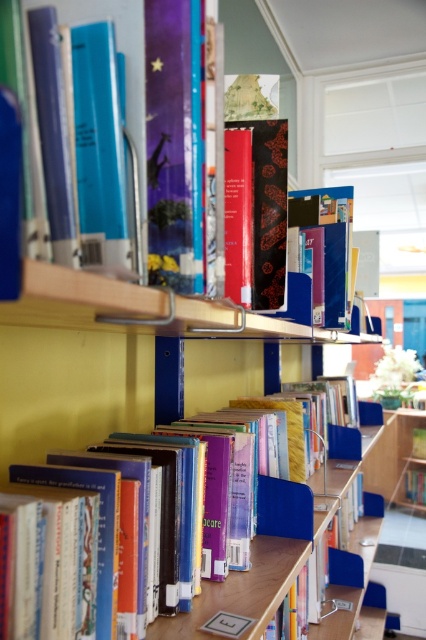
Measure the distance between matte black book at center and camera.

matte black book at center and camera are 35.36 inches apart.

Does matte black book at center have a greater width compared to matte blue book at center?

Incorrect, matte black book at center's width does not surpass matte blue book at center's.

Who is more distant from viewer, (282, 163) or (325, 305)?

The point (325, 305) is behind.

Locate an element on the screen. matte black book at center is located at coordinates (267, 209).

Does hardcover book at center appear on the right side of matte black book at center?

Correct, you'll find hardcover book at center to the right of matte black book at center.

Can you confirm if hardcover book at center is positioned to the left of matte black book at center?

In fact, hardcover book at center is to the right of matte black book at center.

Is point (109, 513) positioned before point (261, 300)?

Yes, point (109, 513) is closer to viewer.

Where is `hardcover book at center`? The width and height of the screenshot is (426, 640). hardcover book at center is located at coordinates click(187, 512).

Who is more distant from viewer, (46,531) or (325,243)?

The point (325,243) is behind.

Based on the photo, is the position of hardcover book at center more distant than that of matte blue book at center?

No, it is not.

You are a GUI agent. You are given a task and a screenshot of the screen. Output one action in this format:
    pyautogui.click(x=<x>, y=<y>)
    Task: Click on the hardcover book at center
    The image size is (426, 640).
    Given the screenshot: What is the action you would take?
    pyautogui.click(x=187, y=512)